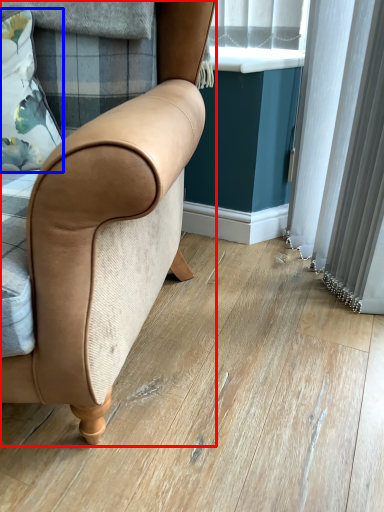
Question: Which of the following is the closest to the observer, chair (highlighted by a red box) or pillow (highlighted by a blue box)?

Choices:
 (A) chair
 (B) pillow

Answer: (A)